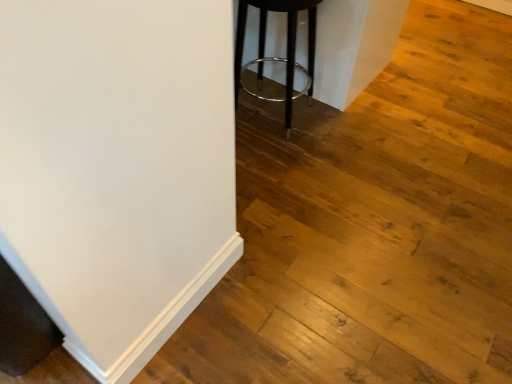
What do you see at coordinates (287, 47) in the screenshot? I see `black metal stool at center` at bounding box center [287, 47].

Find the location of `black metal stool at center`. black metal stool at center is located at coordinates click(287, 47).

Where is `black metal stool at center`? This screenshot has height=384, width=512. black metal stool at center is located at coordinates (287, 47).